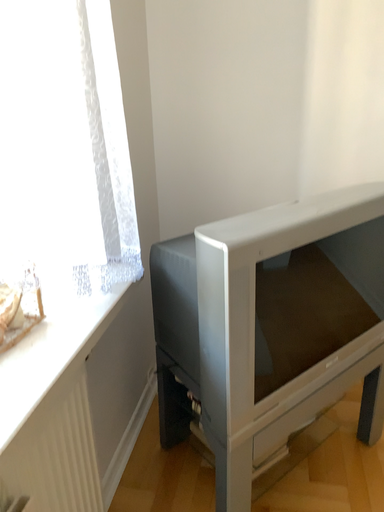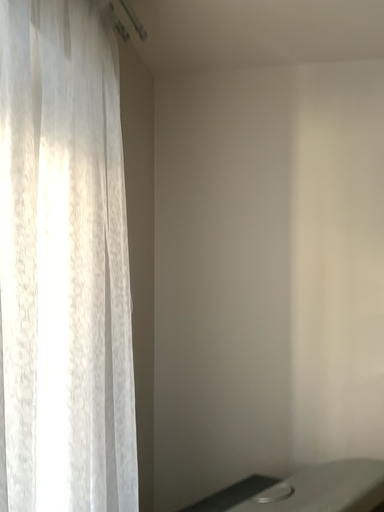
Question: How did the camera likely rotate when shooting the video?

Choices:
 (A) rotated upward
 (B) rotated downward

Answer: (A)